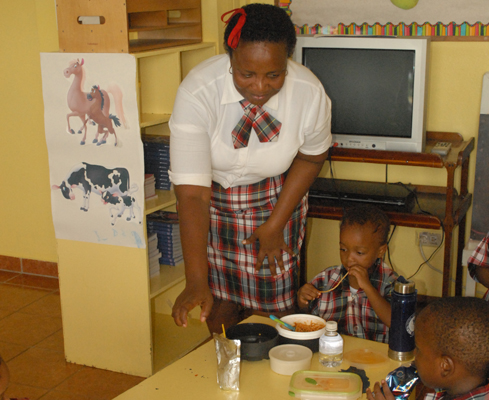
This screenshot has height=400, width=489. I want to click on tan table, so 195,388.